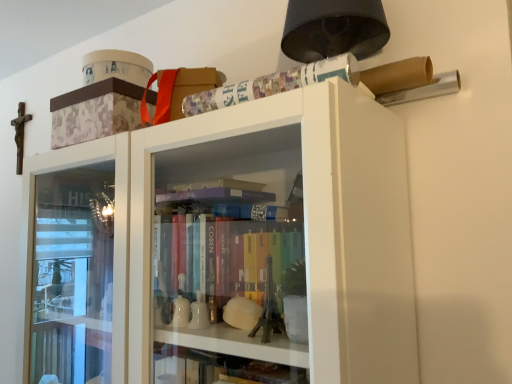
Question: In the image, is multicolored paper at upper right positioned in front of or behind matte floral-patterned box at upper center?

Choices:
 (A) front
 (B) behind

Answer: (A)

Question: From their relative heights in the image, would you say multicolored paper at upper right is taller or shorter than matte floral-patterned box at upper center?

Choices:
 (A) short
 (B) tall

Answer: (A)

Question: Is multicolored paper at upper right bigger or smaller than matte floral-patterned box at upper center?

Choices:
 (A) big
 (B) small

Answer: (B)

Question: Looking at their shapes, would you say matte floral-patterned box at upper center is wider or thinner than multicolored paper at upper right?

Choices:
 (A) wide
 (B) thin

Answer: (A)

Question: Considering their positions, is matte floral-patterned box at upper center located in front of or behind multicolored paper at upper right?

Choices:
 (A) front
 (B) behind

Answer: (B)

Question: In the image, is matte floral-patterned box at upper center on the left side or the right side of multicolored paper at upper right?

Choices:
 (A) right
 (B) left

Answer: (B)

Question: Considering the positions of matte floral-patterned box at upper center and multicolored paper at upper right in the image, is matte floral-patterned box at upper center bigger or smaller than multicolored paper at upper right?

Choices:
 (A) big
 (B) small

Answer: (A)